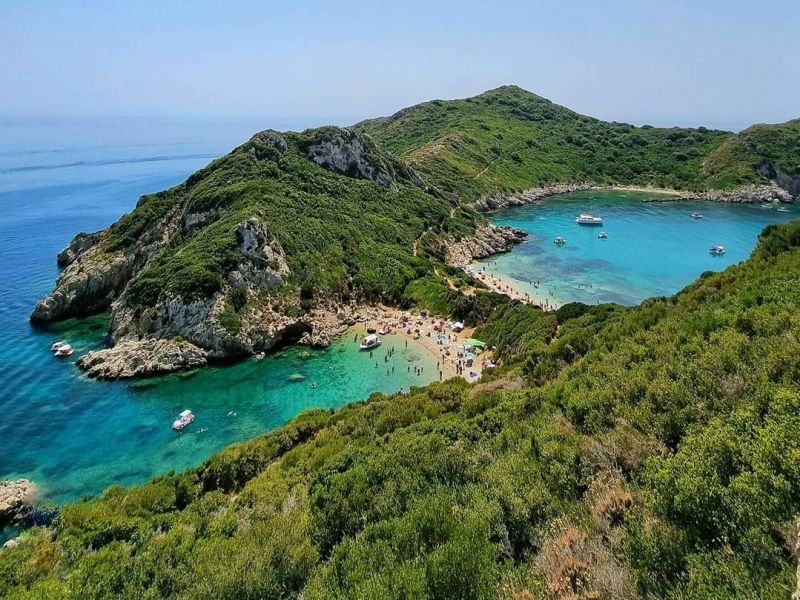
In order to click on green scrubby brush in this screenshot , I will do `click(625, 402)`, `click(362, 253)`, `click(632, 139)`, `click(348, 510)`.